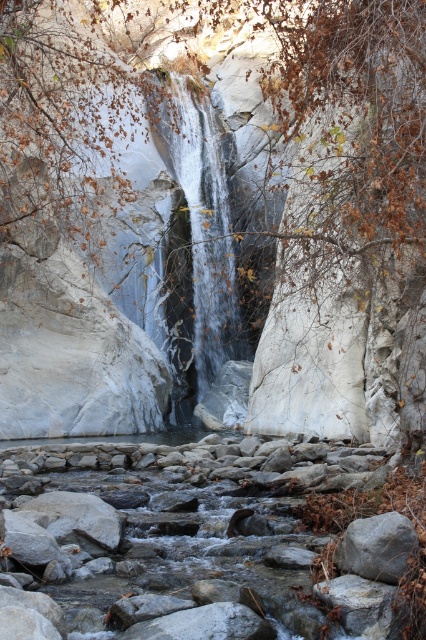
You are standing at the edge of the riverbed and want to cross to the other side. You see a smooth gray rock at center and a gray rough rock at center. Which rock is closer to you?

The smooth gray rock at center is closer to you because the gray rough rock at center is behind it.

You are standing at the base of the waterfall and want to reach the point marked at coordinates (210, 276). Given that the average walking distance for a person is about 70 meters, will you be able to reach that point without getting too tired?

The point at coordinates (210, 276) is 73.28 meters away from the viewer. Since the average walking distance is about 70 meters, reaching this point may require a bit more effort and could result in some tiredness.

You are standing at the edge of the waterfall and see both the smooth gray rock at center and the gray rough rock at center. Which rock is positioned more to the left side from your viewpoint?

The smooth gray rock at center is positioned more to the left side from your viewpoint compared to the gray rough rock at center.